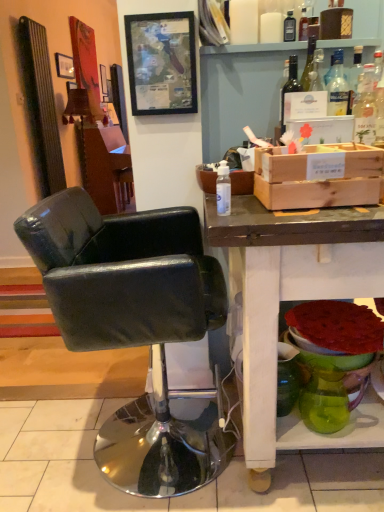
Question: Is translucent glass bottle at upper right, placed as the second bottle when sorted from left to right, smaller than green glass vase at lower right?

Choices:
 (A) yes
 (B) no

Answer: (A)

Question: Does translucent glass bottle at upper right, the 2th bottle from the front, have a greater width compared to green glass vase at lower right?

Choices:
 (A) no
 (B) yes

Answer: (A)

Question: From a real-world perspective, is translucent glass bottle at upper right, the 2th bottle from the top, on top of green glass vase at lower right?

Choices:
 (A) yes
 (B) no

Answer: (A)

Question: Is green glass vase at lower right surrounded by translucent glass bottle at upper right, which appears as the 2th bottle when ordered from the bottom?

Choices:
 (A) yes
 (B) no

Answer: (B)

Question: Does translucent glass bottle at upper right, which appears as the 2th bottle when ordered from the bottom, lie in front of green glass vase at lower right?

Choices:
 (A) no
 (B) yes

Answer: (A)

Question: Does point (291, 12) appear closer or farther from the camera than point (276, 197)?

Choices:
 (A) closer
 (B) farther

Answer: (B)

Question: Considering the relative positions of transparent glass bottle at upper center, positioned as the first bottle in top-to-bottom order, and wooden crate at right in the image provided, is transparent glass bottle at upper center, positioned as the first bottle in top-to-bottom order, to the left or to the right of wooden crate at right?

Choices:
 (A) right
 (B) left

Answer: (A)

Question: Is transparent glass bottle at upper center, positioned as the first bottle in top-to-bottom order, bigger or smaller than wooden crate at right?

Choices:
 (A) small
 (B) big

Answer: (A)

Question: From a real-world perspective, relative to wooden crate at right, is transparent glass bottle at upper center, acting as the first bottle starting from the right, vertically above or below?

Choices:
 (A) below
 (B) above

Answer: (B)

Question: From the image's perspective, is matte black picture frame at upper left, placed as the 2th picture frame when sorted from front to back, positioned above or below green glass vase at lower right?

Choices:
 (A) below
 (B) above

Answer: (B)

Question: Considering their positions, is matte black picture frame at upper left, arranged as the first picture frame when viewed from the left, located in front of or behind green glass vase at lower right?

Choices:
 (A) behind
 (B) front

Answer: (A)

Question: From their relative heights in the image, would you say matte black picture frame at upper left, arranged as the first picture frame when viewed from the left, is taller or shorter than green glass vase at lower right?

Choices:
 (A) short
 (B) tall

Answer: (B)

Question: Is matte black picture frame at upper left, placed as the 2th picture frame when sorted from front to back, bigger or smaller than green glass vase at lower right?

Choices:
 (A) big
 (B) small

Answer: (A)

Question: From their relative heights in the image, would you say wooden vanity at center is taller or shorter than matte white desk at lower right?

Choices:
 (A) short
 (B) tall

Answer: (B)

Question: Looking at their shapes, would you say wooden vanity at center is wider or thinner than matte white desk at lower right?

Choices:
 (A) wide
 (B) thin

Answer: (B)